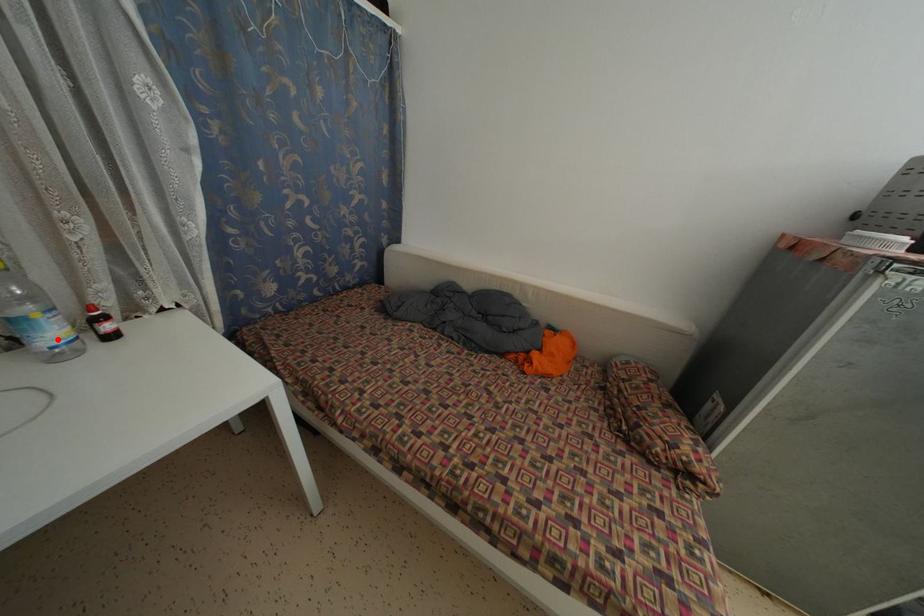
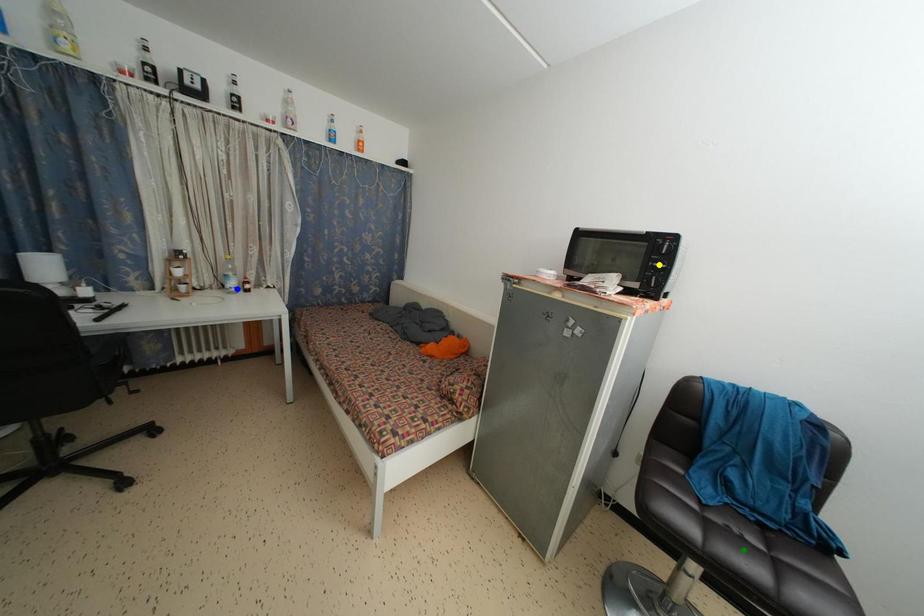
Question: I am providing you with two images of the same scene from different viewpoints. A red point is marked on the first image. You are given multiple points on the second image. Which spot in image 2 lines up with the point in image 1?

Choices:
 (A) yellow point
 (B) blue point
 (C) green point

Answer: (B)